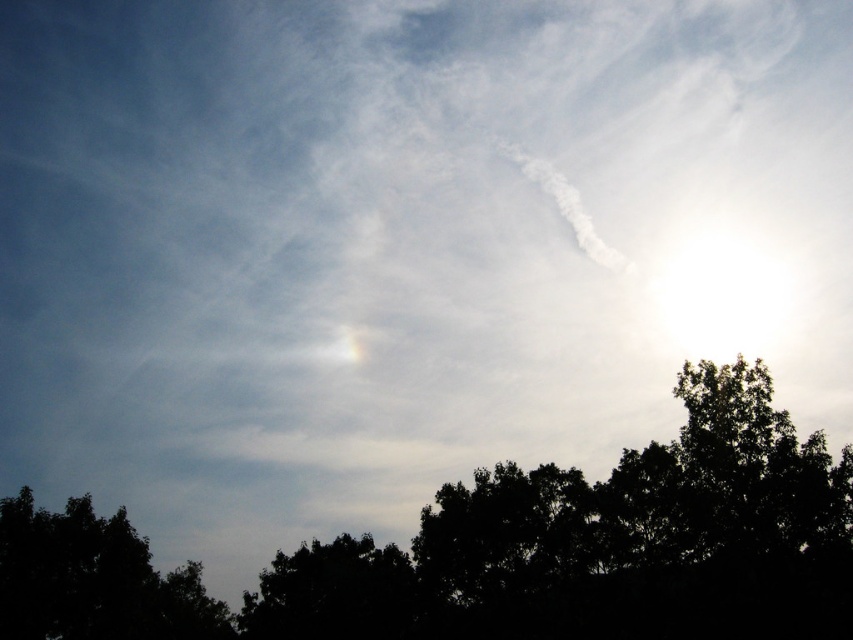
Question: Can you confirm if black leafy tree at lower center is smaller than dark green leafy tree at lower left?

Choices:
 (A) no
 (B) yes

Answer: (A)

Question: Can you confirm if black leafy tree at lower center is positioned above dark green leafy tree at lower left?

Choices:
 (A) yes
 (B) no

Answer: (A)

Question: Which object is closer to the camera taking this photo?

Choices:
 (A) black leafy tree at lower center
 (B) dark green leafy tree at lower left

Answer: (A)

Question: Which point is closer to the camera?

Choices:
 (A) (195, 628)
 (B) (648, 616)

Answer: (B)

Question: Does black leafy tree at lower center appear on the left side of dark green leafy tree at lower left?

Choices:
 (A) yes
 (B) no

Answer: (B)